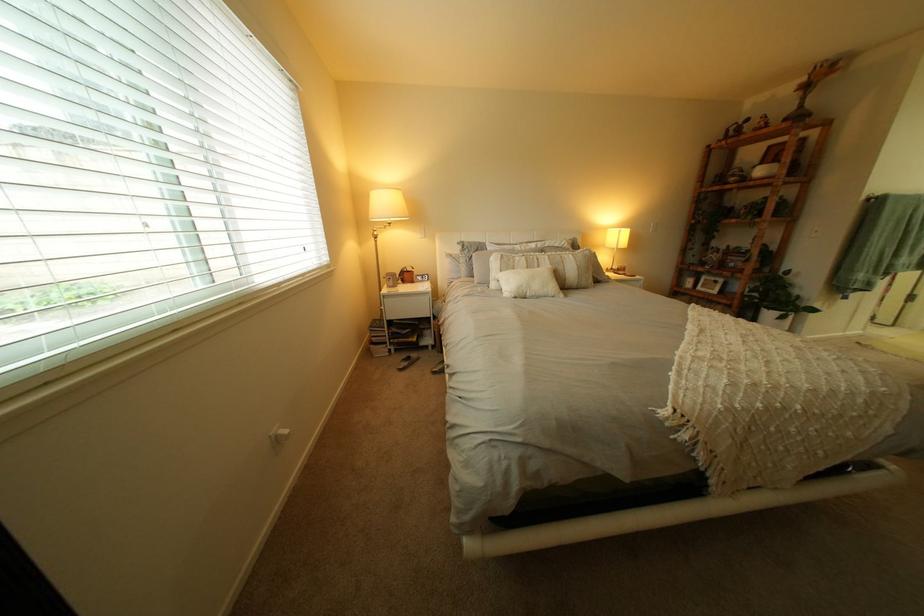
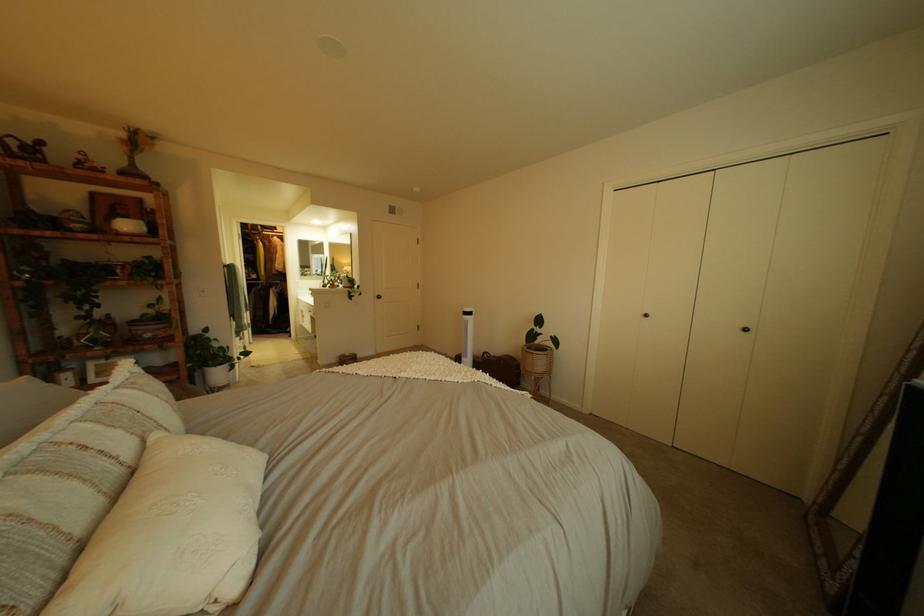
The point at (745,304) is marked in the first image. Where is the corresponding point in the second image?

(189, 379)